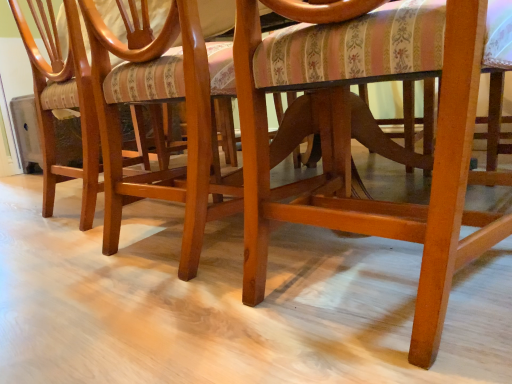
Question: Which direction should I rotate to face matte wood chair at center, acting as the 1th chair starting from the right, — up or down?

Choices:
 (A) down
 (B) up

Answer: (B)

Question: Is matte wood chair at center, acting as the 1th chair starting from the right, thinner than glossy wood chair at lower left, the 2th chair viewed from the right?

Choices:
 (A) no
 (B) yes

Answer: (B)

Question: Is matte wood chair at center, which is the 2th chair from left to right, shorter than glossy wood chair at lower left, placed as the first chair when sorted from left to right?

Choices:
 (A) no
 (B) yes

Answer: (B)

Question: Is matte wood chair at center, acting as the 1th chair starting from the right, oriented towards glossy wood chair at lower left, placed as the first chair when sorted from left to right?

Choices:
 (A) no
 (B) yes

Answer: (A)

Question: Does matte wood chair at center, which is the 2th chair from left to right, appear on the left side of glossy wood chair at lower left, the 2th chair viewed from the right?

Choices:
 (A) no
 (B) yes

Answer: (A)

Question: Is the depth of matte wood chair at center, acting as the 1th chair starting from the right, greater than that of glossy wood chair at lower left, placed as the first chair when sorted from left to right?

Choices:
 (A) yes
 (B) no

Answer: (B)

Question: From a real-world perspective, is matte wood chair at center, which is the 2th chair from left to right, positioned over glossy wood chair at lower left, the 2th chair viewed from the right, based on gravity?

Choices:
 (A) no
 (B) yes

Answer: (A)

Question: Is glossy wood chair at lower left, placed as the first chair when sorted from left to right, shorter than matte wood chair at center, acting as the 1th chair starting from the right?

Choices:
 (A) no
 (B) yes

Answer: (A)

Question: Is the surface of glossy wood chair at lower left, the 2th chair viewed from the right, in direct contact with matte wood chair at center, which is the 2th chair from left to right?

Choices:
 (A) yes
 (B) no

Answer: (B)

Question: Considering the relative sizes of glossy wood chair at lower left, the 2th chair viewed from the right, and matte wood chair at center, acting as the 1th chair starting from the right, in the image provided, is glossy wood chair at lower left, the 2th chair viewed from the right, wider than matte wood chair at center, acting as the 1th chair starting from the right,?

Choices:
 (A) no
 (B) yes

Answer: (B)

Question: Is glossy wood chair at lower left, the 2th chair viewed from the right, at the right side of matte wood chair at center, which is the 2th chair from left to right?

Choices:
 (A) no
 (B) yes

Answer: (A)

Question: Considering the relative sizes of glossy wood chair at lower left, placed as the first chair when sorted from left to right, and matte wood chair at center, which is the 2th chair from left to right, in the image provided, is glossy wood chair at lower left, placed as the first chair when sorted from left to right, taller than matte wood chair at center, which is the 2th chair from left to right,?

Choices:
 (A) yes
 (B) no

Answer: (A)

Question: Considering the relative sizes of glossy wood chair at lower left, the 2th chair viewed from the right, and matte wood chair at center, which is the 2th chair from left to right, in the image provided, is glossy wood chair at lower left, the 2th chair viewed from the right, bigger than matte wood chair at center, which is the 2th chair from left to right,?

Choices:
 (A) yes
 (B) no

Answer: (A)

Question: From a real-world perspective, is matte wood chair at center, which is the 2th chair from left to right, positioned above or below glossy wood chair at lower left, placed as the first chair when sorted from left to right?

Choices:
 (A) above
 (B) below

Answer: (B)